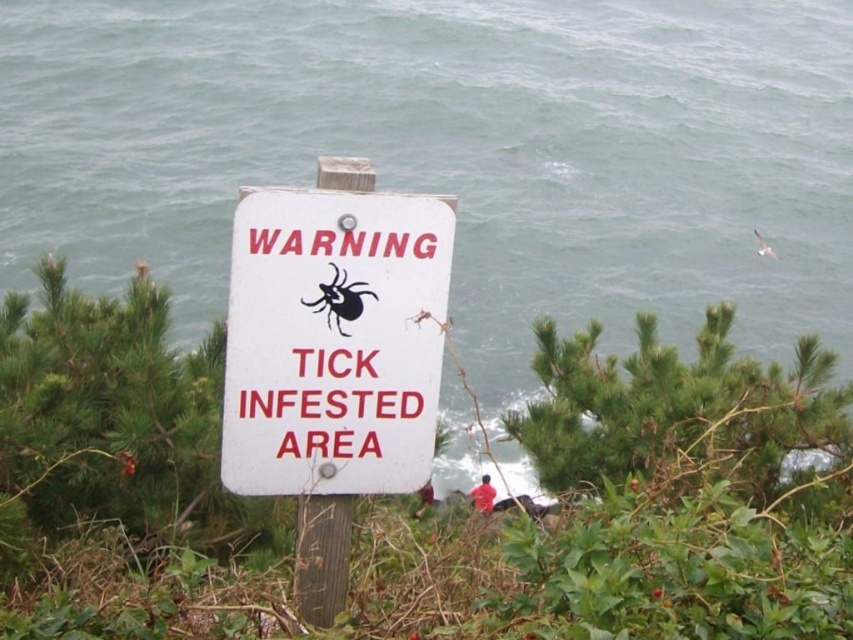
I want to click on white plastic sign at center, so click(334, 340).

Is white plastic sign at center to the right of black matte/spider at center from the viewer's perspective?

Correct, you'll find white plastic sign at center to the right of black matte/spider at center.

What do you see at coordinates (334, 340) in the screenshot?
I see `white plastic sign at center` at bounding box center [334, 340].

What are the coordinates of `white plastic sign at center` in the screenshot? It's located at (334, 340).